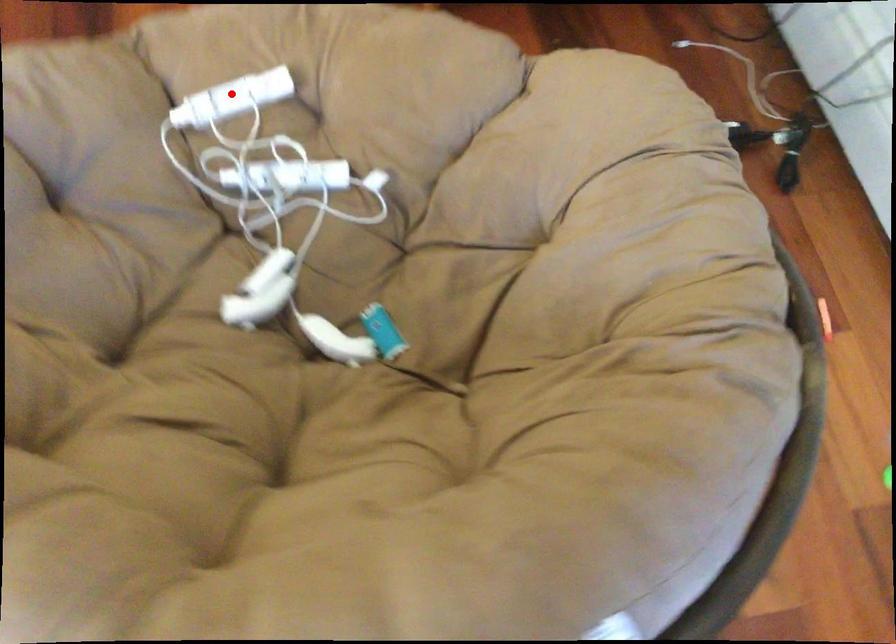
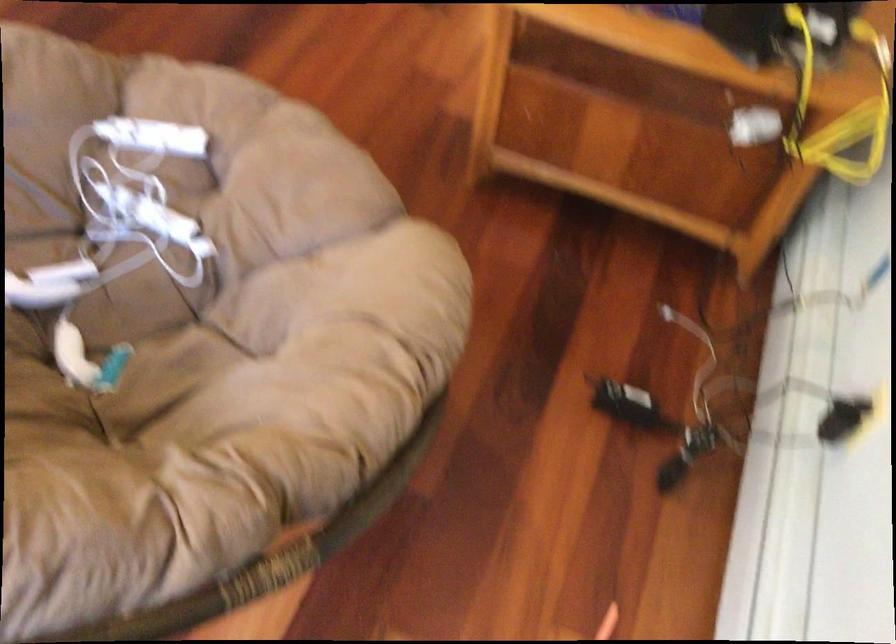
The point at the highlighted location is marked in the first image. Where is the corresponding point in the second image?

(152, 137)